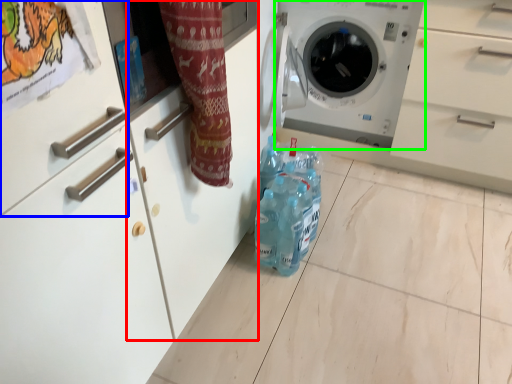
Question: Based on their relative distances, which object is nearer to cabinetry (highlighted by a red box)? Choose from drawer (highlighted by a blue box) and washing machine (highlighted by a green box).

Choices:
 (A) drawer
 (B) washing machine

Answer: (A)